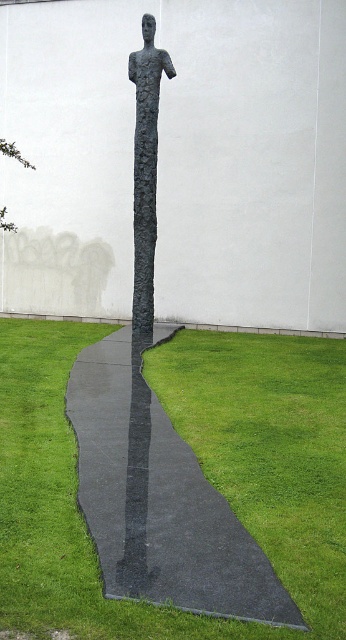
Is black asphalt at center to the left of dark textured statue at center from the viewer's perspective?

Correct, you'll find black asphalt at center to the left of dark textured statue at center.

Between black asphalt at center and dark textured statue at center, which one appears on the right side from the viewer's perspective?

dark textured statue at center

Is point (177, 570) behind point (141, 134)?

No.

Image resolution: width=346 pixels, height=640 pixels. I want to click on black asphalt at center, so click(159, 499).